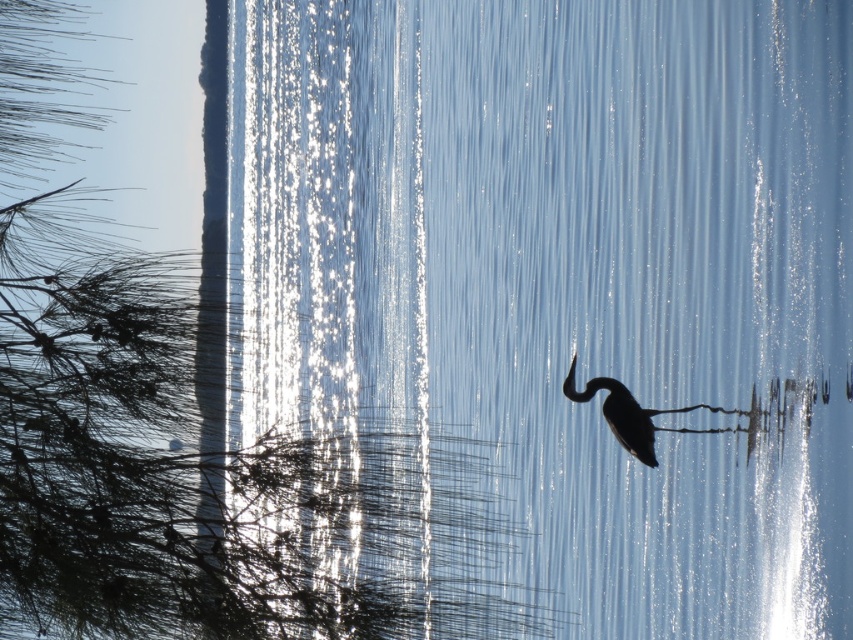
You are a photographer trying to capture the silhouette matte bird at center and the green leafy tree at upper left in your shot. Based on their positions, which object would appear higher in the frame?

The green leafy tree at upper left is located above the silhouette matte bird at center, so it would appear higher in the frame.

You are a photographer trying to capture the silhouette matte bird at center and the green leafy tree at upper left in the same frame. Based on their positions, which object would appear closer to the left edge of your photo?

The green leafy tree at upper left is positioned on the left side of the silhouette matte bird at center, so it would appear closer to the left edge of the photo.